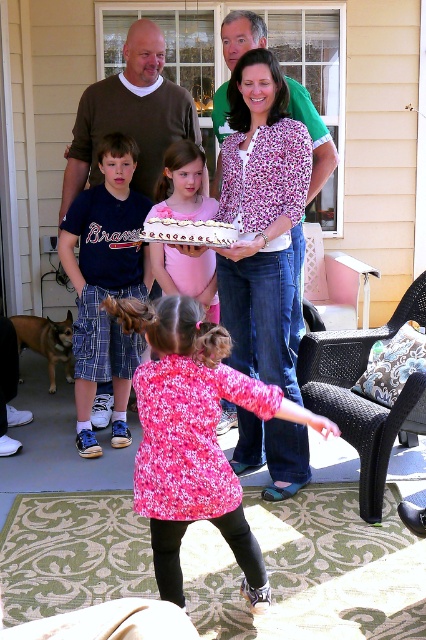
Question: Does matte blue shirt at left appear under pink satin dress at center?

Choices:
 (A) no
 (B) yes

Answer: (B)

Question: Can you confirm if brown sweater at upper left is positioned to the right of pink satin dress at center?

Choices:
 (A) no
 (B) yes

Answer: (A)

Question: Does matte blue shirt at left have a greater width compared to pink satin dress at center?

Choices:
 (A) yes
 (B) no

Answer: (A)

Question: Which object is closer to the camera taking this photo?

Choices:
 (A) pink satin dress at center
 (B) floral blouse at center
 (C) brown sweater at upper left

Answer: (B)

Question: Which of the following is the closest to the observer?

Choices:
 (A) white frosted cake at center
 (B) matte blue shirt at left
 (C) brown sweater at upper left

Answer: (A)

Question: Which point is farther to the camera?

Choices:
 (A) matte blue shirt at left
 (B) pink satin dress at center

Answer: (A)